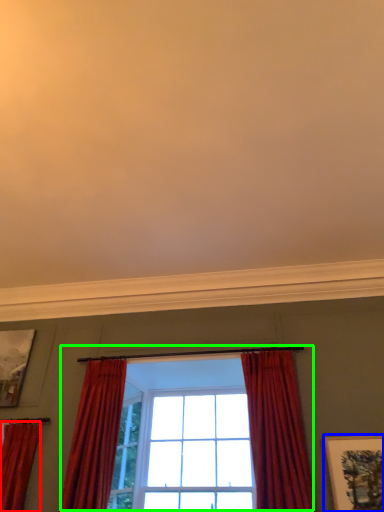
Question: Considering the real-world distances, which object is closest to curtain (highlighted by a red box)? picture frame (highlighted by a blue box) or window (highlighted by a green box).

Choices:
 (A) picture frame
 (B) window

Answer: (B)